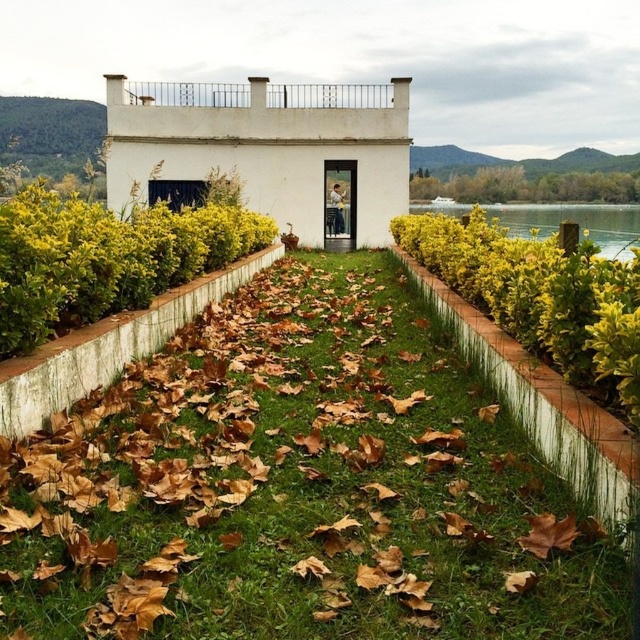
Question: Which object is closer to the camera taking this photo?

Choices:
 (A) green grass at center
 (B) green water at right

Answer: (B)

Question: Does green grass at center lie in front of green water at right?

Choices:
 (A) yes
 (B) no

Answer: (B)

Question: Does green grass at center have a smaller size compared to green water at right?

Choices:
 (A) yes
 (B) no

Answer: (A)

Question: Does green grass at center appear under green water at right?

Choices:
 (A) yes
 (B) no

Answer: (A)